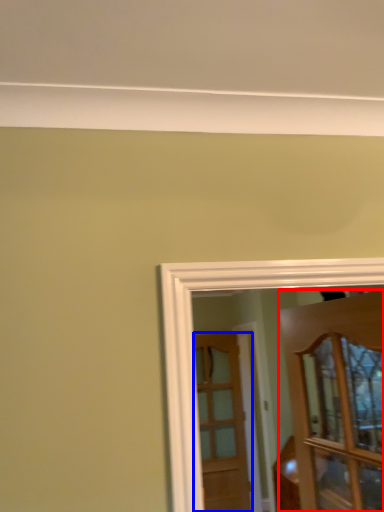
Question: Which of the following is the closest to the observer, door (highlighted by a red box) or door (highlighted by a blue box)?

Choices:
 (A) door
 (B) door

Answer: (A)